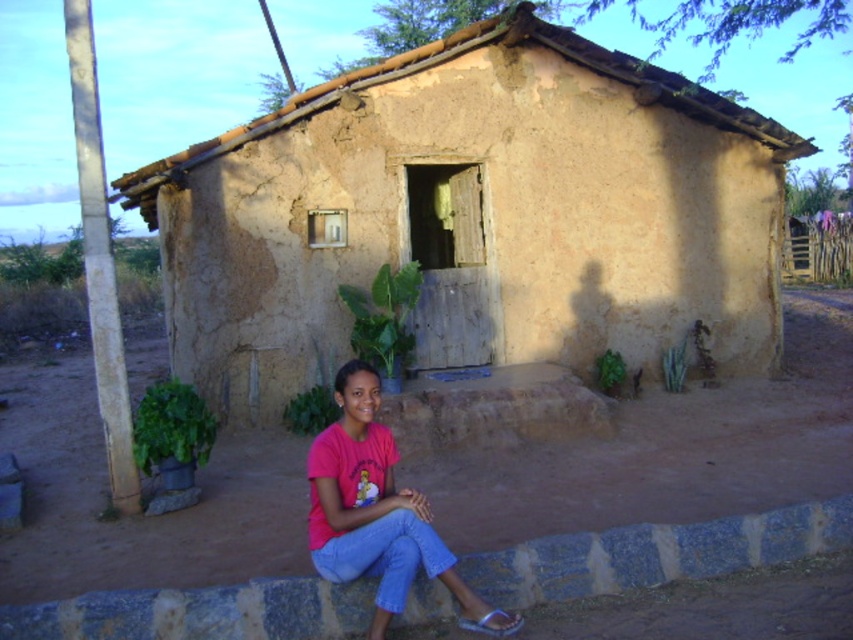
Looking at this image, you are standing in front of the brown mud hut at center and the pink matte shirt at center. Which object is positioned to the right?

The brown mud hut at center is positioned to the right of the pink matte shirt at center.

You are standing at the origin point of the coordinate system. You want to walk to the brown mud hut at center. In which direction should you walk?

Since the brown mud hut at center is located at coordinate point (473,216), you should walk northeast to reach it.

You are standing in a field and see the brown mud hut at center and the brown dirt field at center. Which object is closer to you?

The brown mud hut at center is closer to you because it is positioned over the brown dirt field at center, indicating it is in front of it.